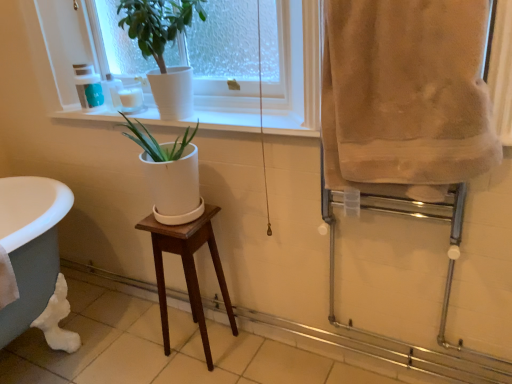
Question: From a real-world perspective, is beige soft towel at right positioned above or below matte green plastic cup at upper left, placed as the 2th toiletry when sorted from right to left?

Choices:
 (A) below
 (B) above

Answer: (B)

Question: Would you say beige soft towel at right is inside or outside matte green plastic cup at upper left, the first toiletry positioned from the left?

Choices:
 (A) outside
 (B) inside

Answer: (A)

Question: Which of these objects is positioned closest to the matte green plastic cup at upper left, the first toiletry positioned from the left?

Choices:
 (A) beige soft towel at right
 (B) white ceramic at upper center
 (C) white glossy candle at upper left, which ranks as the first toiletry in right-to-left order
 (D) white ceramic pot at upper center
 (E) mahogany wood stool at center

Answer: (C)

Question: Which object is the farthest from the white ceramic pot at upper center?

Choices:
 (A) matte green plastic cup at upper left, placed as the 2th toiletry when sorted from right to left
 (B) white glossy candle at upper left, the 2th toiletry in the left-to-right sequence
 (C) mahogany wood stool at center
 (D) white ceramic at upper center
 (E) beige soft towel at right

Answer: (C)